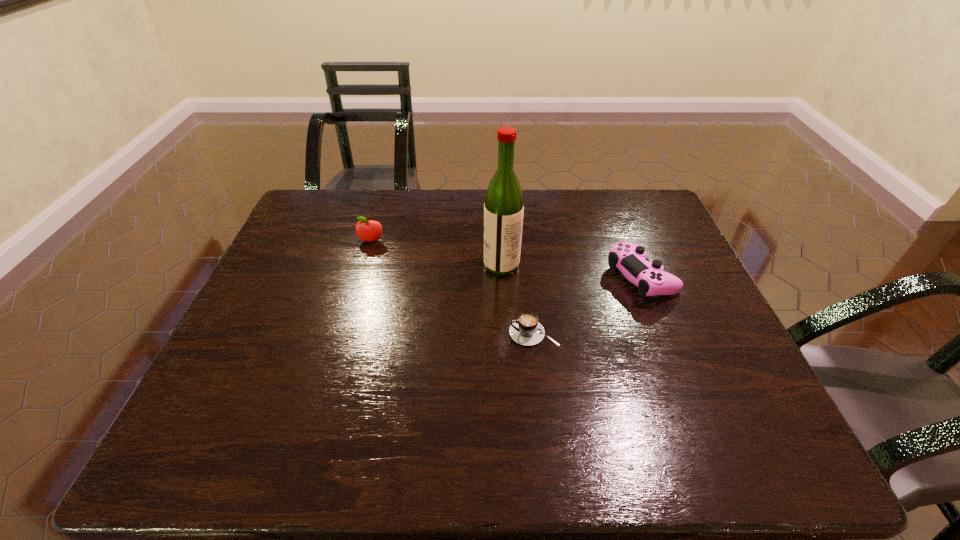
What are the coordinates of `the tallest object` in the screenshot? It's located at (504, 203).

Where is `the leftmost object`? the leftmost object is located at coordinates (368, 230).

The height and width of the screenshot is (540, 960). Find the location of `the farthest object`. the farthest object is located at coordinates (368, 230).

Find the location of a particular element. This screenshot has height=540, width=960. the rightmost object is located at coordinates (630, 258).

This screenshot has height=540, width=960. Find the location of `the second shortest object`. the second shortest object is located at coordinates (630, 258).

Locate an element on the screen. The width and height of the screenshot is (960, 540). cappuccino is located at coordinates (526, 330).

Find the location of `the nearest object`. the nearest object is located at coordinates (526, 330).

This screenshot has width=960, height=540. What are the coordinates of `free space located 0.340m on the label of the liquor` in the screenshot? It's located at (364, 265).

Where is `vacant space situated 0.150m on the label of the liquor`? This screenshot has height=540, width=960. vacant space situated 0.150m on the label of the liquor is located at coordinates (431, 265).

This screenshot has height=540, width=960. I want to click on free space located on the label of the liquor, so click(378, 265).